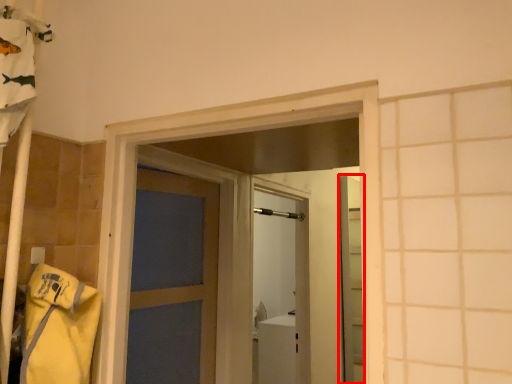
Question: In this image, where is elevator (annotated by the red box) located relative to shower?

Choices:
 (A) left
 (B) right

Answer: (B)